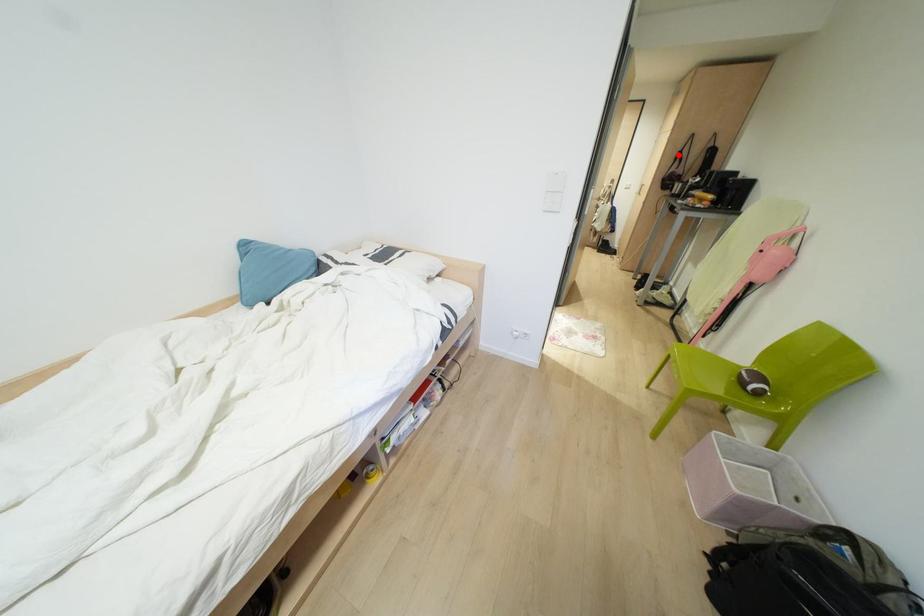
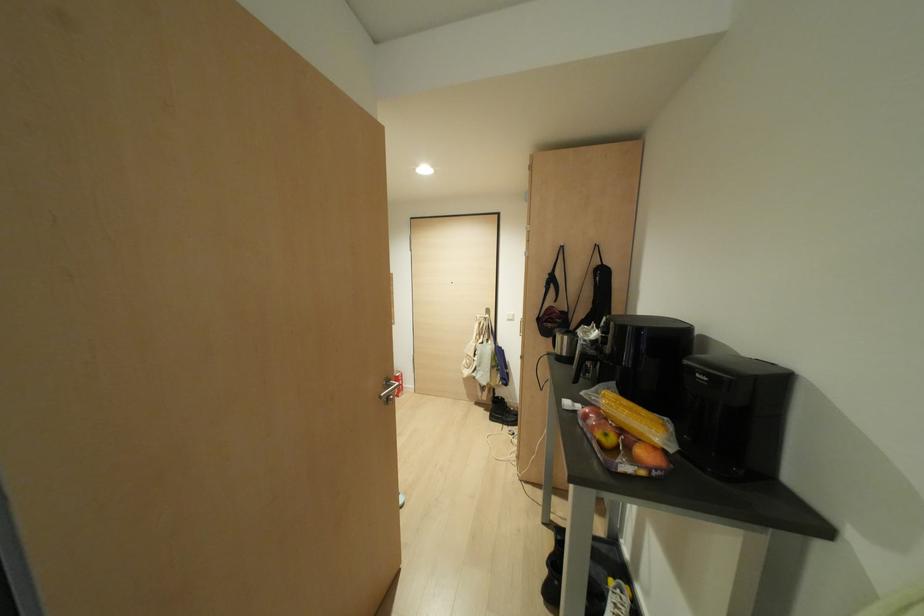
Where in the second image is the point corresponding to the highlighted location from the first image?

(551, 280)